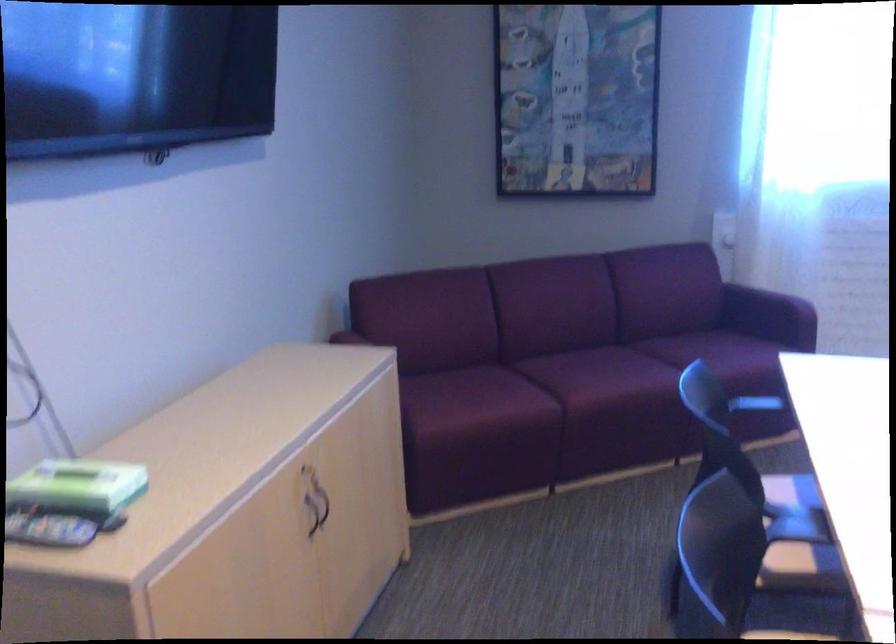
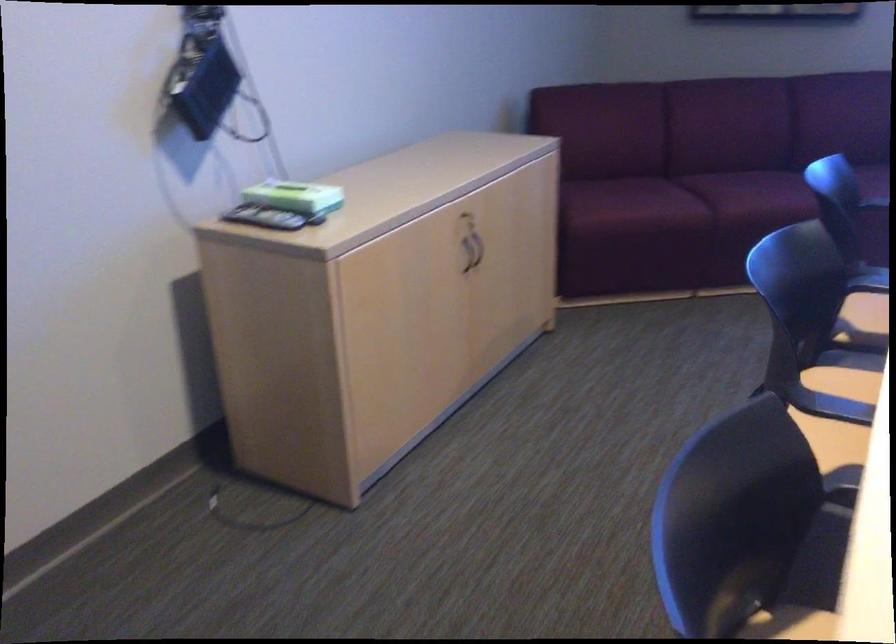
In the second image, find the point that corresponds to the point at 587,386 in the first image.

(745, 198)